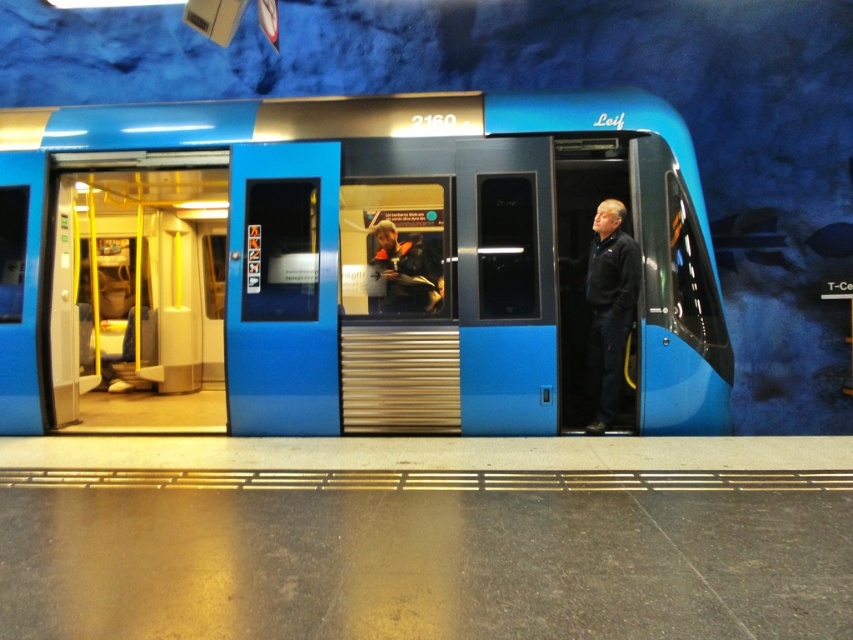
Question: Can you confirm if blue metallic train at center is smaller than blue glossy door at center?

Choices:
 (A) no
 (B) yes

Answer: (B)

Question: Is blue metallic train at center to the left of dark blue jacket at center from the viewer's perspective?

Choices:
 (A) no
 (B) yes

Answer: (B)

Question: Which point is closer to the camera?

Choices:
 (A) blue metallic train at center
 (B) dark blue jacket at center
 (C) blue glossy door at center

Answer: (B)

Question: Is blue metallic train at center further to camera compared to dark blue jacket at center?

Choices:
 (A) no
 (B) yes

Answer: (B)

Question: Which object is positioned farthest from the blue metallic train at center?

Choices:
 (A) dark blue jacket at center
 (B) blue glossy door at center

Answer: (A)

Question: Which object is the closest to the blue metallic train at center?

Choices:
 (A) dark blue jacket at center
 (B) blue glossy door at center

Answer: (B)